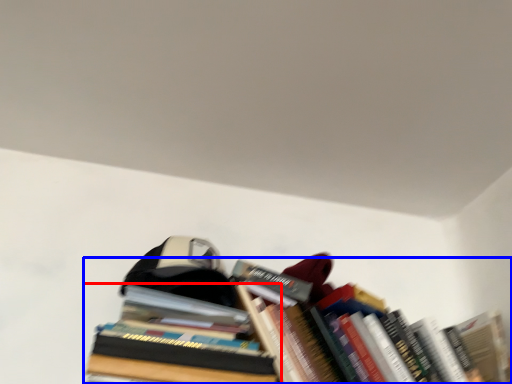
Question: Which object appears closest to the camera in this image, book (highlighted by a red box) or book (highlighted by a blue box)?

Choices:
 (A) book
 (B) book

Answer: (A)